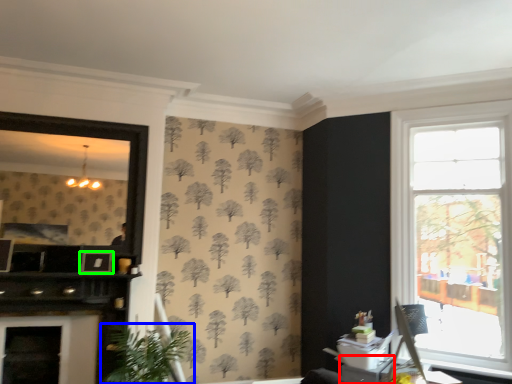
Question: Which object is positioned closest to table (highlighted by a red box)? Select from houseplant (highlighted by a blue box) and picture frame (highlighted by a green box).

Choices:
 (A) houseplant
 (B) picture frame

Answer: (A)